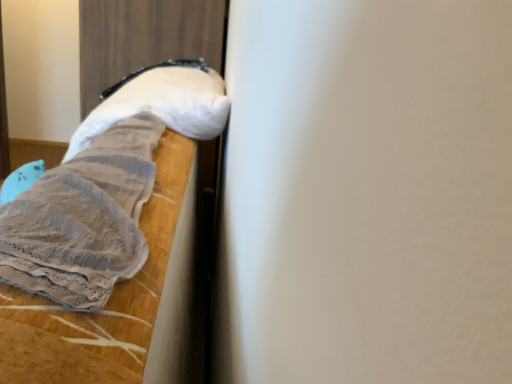
Question: Is white fluffy pillow at upper left facing away from gray textured fabric at left?

Choices:
 (A) yes
 (B) no

Answer: (B)

Question: Does white fluffy pillow at upper left have a lesser width compared to gray textured fabric at left?

Choices:
 (A) no
 (B) yes

Answer: (A)

Question: Considering the relative positions of white fluffy pillow at upper left and gray textured fabric at left in the image provided, is white fluffy pillow at upper left to the right of gray textured fabric at left from the viewer's perspective?

Choices:
 (A) no
 (B) yes

Answer: (A)

Question: From a real-world perspective, is white fluffy pillow at upper left below gray textured fabric at left?

Choices:
 (A) no
 (B) yes

Answer: (A)

Question: Considering the relative positions of white fluffy pillow at upper left and gray textured fabric at left in the image provided, is white fluffy pillow at upper left behind gray textured fabric at left?

Choices:
 (A) no
 (B) yes

Answer: (B)

Question: From a real-world perspective, does white fluffy pillow at upper left stand above gray textured fabric at left?

Choices:
 (A) yes
 (B) no

Answer: (A)

Question: Is gray textured fabric at left smaller than white fluffy pillow at upper left?

Choices:
 (A) no
 (B) yes

Answer: (B)

Question: From a real-world perspective, is gray textured fabric at left located beneath white fluffy pillow at upper left?

Choices:
 (A) no
 (B) yes

Answer: (B)

Question: Is gray textured fabric at left positioned in front of white fluffy pillow at upper left?

Choices:
 (A) yes
 (B) no

Answer: (A)

Question: Considering the relative sizes of gray textured fabric at left and white fluffy pillow at upper left in the image provided, is gray textured fabric at left bigger than white fluffy pillow at upper left?

Choices:
 (A) no
 (B) yes

Answer: (A)

Question: From the image's perspective, is gray textured fabric at left on white fluffy pillow at upper left?

Choices:
 (A) yes
 (B) no

Answer: (B)

Question: Considering the relative sizes of gray textured fabric at left and white fluffy pillow at upper left in the image provided, is gray textured fabric at left shorter than white fluffy pillow at upper left?

Choices:
 (A) no
 (B) yes

Answer: (A)

Question: Is white fluffy pillow at upper left inside the boundaries of gray textured fabric at left, or outside?

Choices:
 (A) inside
 (B) outside

Answer: (B)